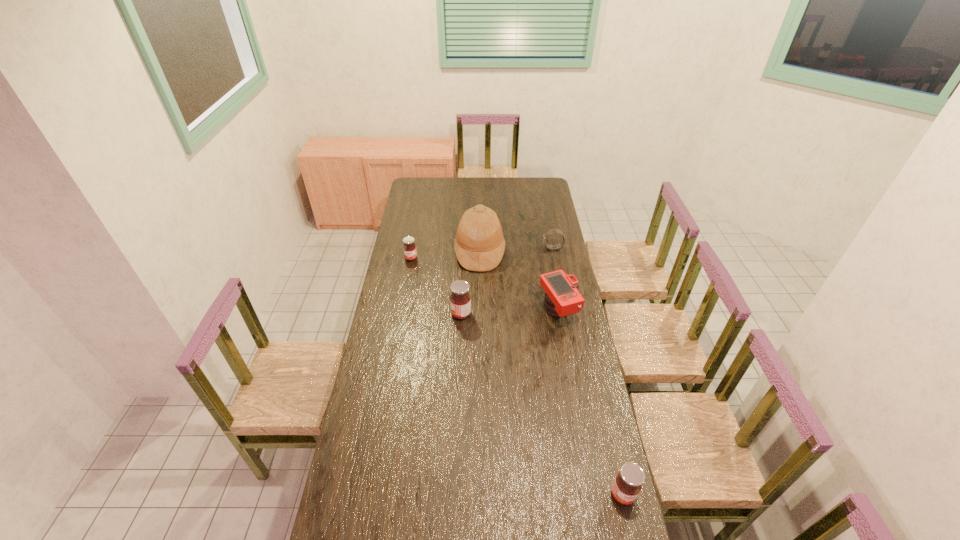
The width and height of the screenshot is (960, 540). I want to click on the leftmost object, so click(x=410, y=252).

You are a GUI agent. You are given a task and a screenshot of the screen. Output one action in this format:
    pyautogui.click(x=<x>, y=<y>)
    Task: Click on the leftmost jam
    
    Given the screenshot: What is the action you would take?
    pyautogui.click(x=410, y=252)

You are a GUI agent. You are given a task and a screenshot of the screen. Output one action in this format:
    pyautogui.click(x=<x>, y=<y>)
    Task: Click on the second jam from right to left
    The image size is (960, 540).
    Given the screenshot: What is the action you would take?
    pyautogui.click(x=460, y=299)

Where is `the nearest jam`? This screenshot has width=960, height=540. the nearest jam is located at coordinates point(627,484).

The height and width of the screenshot is (540, 960). In order to click on the rightmost jam in this screenshot , I will do `click(627, 484)`.

This screenshot has width=960, height=540. What are the coordinates of `the tallest object` in the screenshot? It's located at (479, 244).

Identify the location of watch. This screenshot has width=960, height=540. (552, 231).

Locate an element on the screen. The image size is (960, 540). camera is located at coordinates (562, 299).

Identify the location of vacant area situated 0.380m on the label side of the shortest jam. (401, 315).

Identify the location of free space located 0.160m on the label side of the second jam from left to right. (417, 314).